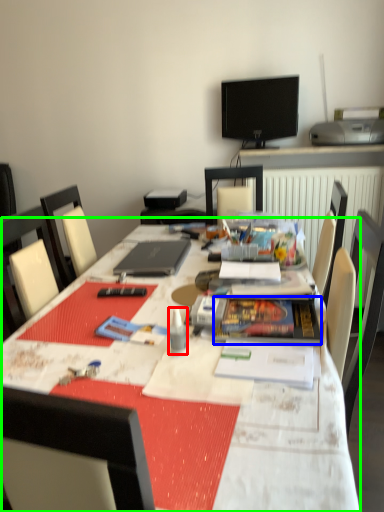
Question: Based on their relative distances, which object is nearer to stationery (highlighted by a red box)? Choose from paperback book (highlighted by a blue box) and table (highlighted by a green box).

Choices:
 (A) paperback book
 (B) table

Answer: (A)